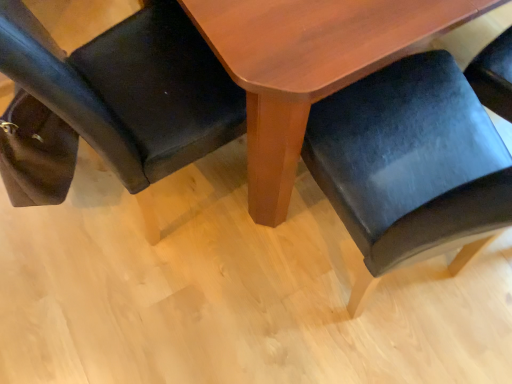
Question: Is velvet black chair at lower right, acting as the 2th chair starting from the left, positioned beyond the bounds of matte black chair at lower left, marked as the 2th chair in a right-to-left arrangement?

Choices:
 (A) yes
 (B) no

Answer: (A)

Question: Is the depth of velvet black chair at lower right, which is counted as the first chair, starting from the right, greater than that of matte black chair at lower left, marked as the 2th chair in a right-to-left arrangement?

Choices:
 (A) no
 (B) yes

Answer: (A)

Question: Is velvet black chair at lower right, acting as the 2th chair starting from the left, taller than matte black chair at lower left, marked as the 2th chair in a right-to-left arrangement?

Choices:
 (A) yes
 (B) no

Answer: (A)

Question: Is the surface of velvet black chair at lower right, which is counted as the first chair, starting from the right, in direct contact with matte black chair at lower left, the first chair positioned from the left?

Choices:
 (A) no
 (B) yes

Answer: (A)

Question: Is the depth of velvet black chair at lower right, which is counted as the first chair, starting from the right, less than that of matte black chair at lower left, the first chair positioned from the left?

Choices:
 (A) no
 (B) yes

Answer: (B)

Question: Is wooden table at center situated inside matte black chair at lower left, the first chair positioned from the left, or outside?

Choices:
 (A) outside
 (B) inside

Answer: (A)

Question: Is wooden table at center taller or shorter than matte black chair at lower left, marked as the 2th chair in a right-to-left arrangement?

Choices:
 (A) tall
 (B) short

Answer: (B)

Question: In terms of width, does wooden table at center look wider or thinner when compared to matte black chair at lower left, the first chair positioned from the left?

Choices:
 (A) wide
 (B) thin

Answer: (A)

Question: From the image's perspective, relative to matte black chair at lower left, the first chair positioned from the left, is wooden table at center above or below?

Choices:
 (A) below
 (B) above

Answer: (B)

Question: Is velvet black chair at lower right, which is counted as the first chair, starting from the right, inside or outside of matte black chair at lower left, the first chair positioned from the left?

Choices:
 (A) outside
 (B) inside

Answer: (A)

Question: Would you say velvet black chair at lower right, acting as the 2th chair starting from the left, is to the left or to the right of matte black chair at lower left, marked as the 2th chair in a right-to-left arrangement, in the picture?

Choices:
 (A) left
 (B) right

Answer: (B)

Question: From a real-world perspective, is velvet black chair at lower right, which is counted as the first chair, starting from the right, physically located above or below matte black chair at lower left, the first chair positioned from the left?

Choices:
 (A) above
 (B) below

Answer: (A)

Question: Based on their sizes in the image, would you say velvet black chair at lower right, acting as the 2th chair starting from the left, is bigger or smaller than matte black chair at lower left, the first chair positioned from the left?

Choices:
 (A) big
 (B) small

Answer: (A)

Question: In terms of size, does matte black chair at lower left, marked as the 2th chair in a right-to-left arrangement, appear bigger or smaller than velvet black chair at lower right, acting as the 2th chair starting from the left?

Choices:
 (A) big
 (B) small

Answer: (B)

Question: Is matte black chair at lower left, the first chair positioned from the left, taller or shorter than velvet black chair at lower right, acting as the 2th chair starting from the left?

Choices:
 (A) tall
 (B) short

Answer: (B)